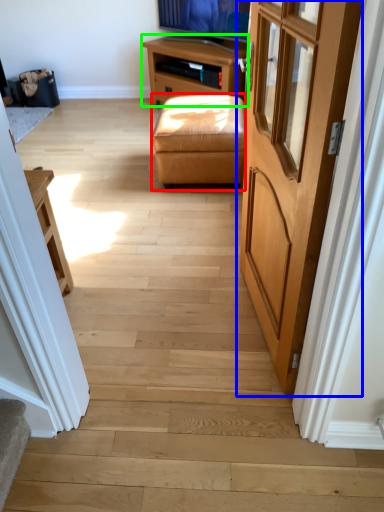
Question: Which is farther away from stool (highlighted by a red box)? door (highlighted by a blue box) or table (highlighted by a green box)?

Choices:
 (A) door
 (B) table

Answer: (A)